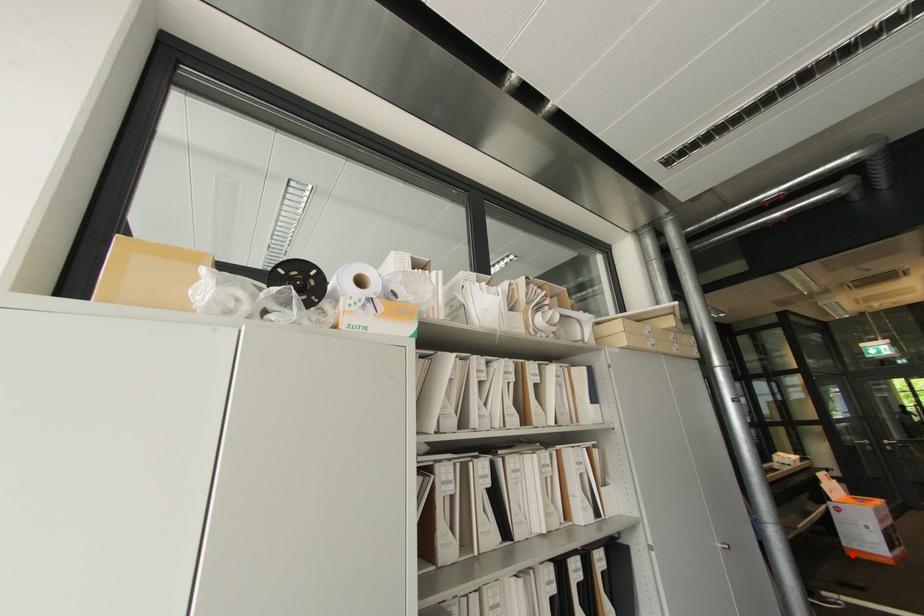
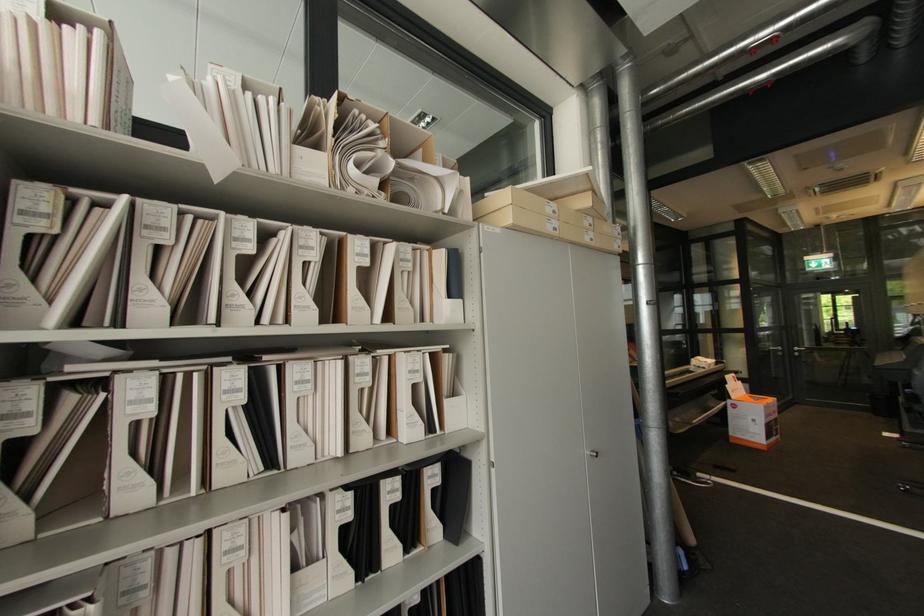
Locate, in the second image, the point that corresponds to the highlighted location in the first image.

(736, 442)